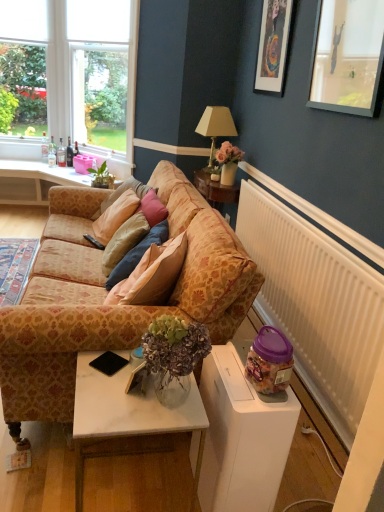
Identify the location of pink fabric couch at left. (34, 181).

Image resolution: width=384 pixels, height=512 pixels. What do you see at coordinates (34, 181) in the screenshot?
I see `pink fabric couch at left` at bounding box center [34, 181].

Locate an element on the screen. purple plastic jar at lower right is located at coordinates (242, 436).

I want to click on green leafy plant at center, so click(101, 177).

You are a GUI agent. You are given a task and a screenshot of the screen. Output one action in this format:
    pyautogui.click(x=<x>, y=<y>)
    Task: Click on the matte black picture frame at upper right
    
    Given the screenshot: What is the action you would take?
    pyautogui.click(x=273, y=46)

Describe the element at coordinates (70, 74) in the screenshot. I see `clear glass window at upper left` at that location.

At what (x,y) coordinates should I click in order to perform the action: click on clear glass window at upper left. Please return your answer as a coordinate pair (x, y). The width and height of the screenshot is (384, 512). Looking at the image, I should click on [24, 64].

From the picture: Who is bigger, matte gold lamp at upper center or black matte phone at lower center?

matte gold lamp at upper center is bigger.

Does matte gold lamp at upper center contain black matte phone at lower center?

No, black matte phone at lower center is not a part of matte gold lamp at upper center.

Could you tell me if matte gold lamp at upper center is turned towards black matte phone at lower center?

No, matte gold lamp at upper center is not turned towards black matte phone at lower center.

From a real-world perspective, which object rests below the other?

From a 3D spatial view, black matte phone at lower center is below.

Is purple plastic jar at lower right located within green leafy plant at center?

No, purple plastic jar at lower right is not inside green leafy plant at center.

How much distance is there between green leafy plant at center and purple plastic jar at lower right?

A distance of 2.54 meters exists between green leafy plant at center and purple plastic jar at lower right.

Is green leafy plant at center smaller than purple plastic jar at lower right?

Yes, green leafy plant at center is smaller than purple plastic jar at lower right.

Are green leafy plant at center and purple plastic jar at lower right making contact?

No, green leafy plant at center is not making contact with purple plastic jar at lower right.

Is purple plastic jar at lower right positioned behind white marble table at lower center?

→ Yes, purple plastic jar at lower right is further from the camera.

How many degrees apart are the facing directions of purple plastic jar at lower right and white marble table at lower center?

0.143 degrees.

Considering the relative sizes of purple plastic jar at lower right and white marble table at lower center in the image provided, is purple plastic jar at lower right bigger than white marble table at lower center?

Incorrect, purple plastic jar at lower right is not larger than white marble table at lower center.

From a real-world perspective, is purple plastic jar at lower right physically above white marble table at lower center?

Yes, from a real-world perspective, purple plastic jar at lower right is above white marble table at lower center.

From a real-world perspective, does matte gold lamp at upper center stand above patterned fabric couch at center?

Yes, from a real-world perspective, matte gold lamp at upper center is on top of patterned fabric couch at center.

From the picture: What's the angular difference between matte gold lamp at upper center and patterned fabric couch at center's facing directions?

0.321 degrees separate the facing orientations of matte gold lamp at upper center and patterned fabric couch at center.

From the image's perspective, who appears lower, matte gold lamp at upper center or patterned fabric couch at center?

From the image's view, patterned fabric couch at center is below.

Locate an element on the screen. bottle that is the 2nd one when counting downward from the matte black picture frame at upper right (from the image's perspective) is located at coordinates (52, 153).

What's the angular difference between translucent glass bottle at window, the second bottle positioned from the left, and matte black picture frame at upper right's facing directions?

translucent glass bottle at window, the second bottle positioned from the left, and matte black picture frame at upper right are facing 91.4 degrees away from each other.

Which is correct: translucent glass bottle at window, which is counted as the third bottle, starting from the right, is inside matte black picture frame at upper right, or outside of it?

translucent glass bottle at window, which is counted as the third bottle, starting from the right, is located beyond the bounds of matte black picture frame at upper right.

Is translucent glass bottle at window, which is counted as the third bottle, starting from the right, facing away from matte black picture frame at upper right?

No.

Is dark brown glass bottle at left, positioned as the first bottle in right-to-left order, situated inside translucent glass bottle at window, which is counted as the third bottle, starting from the right, or outside?

dark brown glass bottle at left, positioned as the first bottle in right-to-left order, cannot be found inside translucent glass bottle at window, which is counted as the third bottle, starting from the right.

Is dark brown glass bottle at left, placed as the 4th bottle when sorted from left to right, beside translucent glass bottle at window, which is counted as the third bottle, starting from the right?

dark brown glass bottle at left, placed as the 4th bottle when sorted from left to right, and translucent glass bottle at window, which is counted as the third bottle, starting from the right, are clearly separated.

Can you confirm if dark brown glass bottle at left, placed as the 4th bottle when sorted from left to right, is positioned to the right of translucent glass bottle at window, the second bottle positioned from the left?

Correct, you'll find dark brown glass bottle at left, placed as the 4th bottle when sorted from left to right, to the right of translucent glass bottle at window, the second bottle positioned from the left.

Considering the positions of objects dark brown glass bottle at left, placed as the 4th bottle when sorted from left to right, and translucent glass bottle at window, which is counted as the third bottle, starting from the right, in the image provided, who is behind, dark brown glass bottle at left, placed as the 4th bottle when sorted from left to right, or translucent glass bottle at window, which is counted as the third bottle, starting from the right,?

translucent glass bottle at window, which is counted as the third bottle, starting from the right, is further away from the camera.

From the image's perspective, is black plastic remote control at center above purple plastic jar at lower right?

Yes, from the image's perspective, black plastic remote control at center is above purple plastic jar at lower right.

Which is more to the right, black plastic remote control at center or purple plastic jar at lower right?

From the viewer's perspective, purple plastic jar at lower right appears more on the right side.

In terms of width, does black plastic remote control at center look wider or thinner when compared to purple plastic jar at lower right?

Considering their sizes, black plastic remote control at center looks slimmer than purple plastic jar at lower right.

Can you tell me how much black plastic remote control at center and purple plastic jar at lower right differ in facing direction?

There is a 46.5-degree angle between the facing directions of black plastic remote control at center and purple plastic jar at lower right.

Where is `mobile phone in front of the matte gold lamp at upper center`? This screenshot has height=512, width=384. mobile phone in front of the matte gold lamp at upper center is located at coordinates (109, 362).

Locate an element on the screen. The width and height of the screenshot is (384, 512). houseplant behind the purple plastic jar at lower right is located at coordinates (101, 177).

Considering their positions, is white marble table at lower center positioned closer to black plastic remote control at center than pink fabric couch at left?

Among the two, white marble table at lower center is located nearer to black plastic remote control at center.

When comparing their distances from black matte phone at lower center, does patterned fabric couch at center or translucent glass bottle at window, the second bottle positioned from the left, seem closer?

Among the two, patterned fabric couch at center is located nearer to black matte phone at lower center.

From the picture: Based on their spatial positions, is clear glass window at upper left or clear glass bottle at window, the first bottle positioned from the left, further from black matte phone at lower center?

Among the two, clear glass window at upper left is located further to black matte phone at lower center.

Which object lies nearer to the anchor point clear glass window at upper left, pink fabric couch at left or white marble table at lower center?

pink fabric couch at left.

From the image, which object appears to be nearer to clear glass window at upper left, clear glass window at upper left or white marble table at lower center?

clear glass window at upper left is closer to clear glass window at upper left.

When comparing their distances from clear glass bottle at left, the 2th bottle when ordered from right to left, does matte black picture frame at upper right or black matte phone at lower center seem closer?

Among the two, matte black picture frame at upper right is located nearer to clear glass bottle at left, the 2th bottle when ordered from right to left.

Consider the image. Based on their spatial positions, is dark brown glass bottle at left, positioned as the first bottle in right-to-left order, or clear glass bottle at window, the fourth bottle when ordered from right to left, further from patterned fabric couch at center?

clear glass bottle at window, the fourth bottle when ordered from right to left, lies further to patterned fabric couch at center than the other object.

Estimate the real-world distances between objects in this image. Which object is further from translucent glass bottle at window, the second bottle positioned from the left, pink fabric couch at left or clear glass bottle at left, the 2th bottle when ordered from right to left?

Among the two, pink fabric couch at left is located further to translucent glass bottle at window, the second bottle positioned from the left.

Identify the location of picture frame positioned between white marble table at lower center and clear glass window at upper left from near to far. The width and height of the screenshot is (384, 512). (273, 46).

You are a GUI agent. You are given a task and a screenshot of the screen. Output one action in this format:
    pyautogui.click(x=<x>, y=<y>)
    Task: Click on the desk positioned between black plastic remote control at center and translucent glass bottle at window, which is counted as the third bottle, starting from the right, from near to far
    
    Given the screenshot: What is the action you would take?
    pyautogui.click(x=34, y=181)

In order to click on remote control between purple plastic jar at lower right and green leafy plant at center along the z-axis in this screenshot , I will do `click(94, 242)`.

Image resolution: width=384 pixels, height=512 pixels. I want to click on remote control positioned between white marble table at lower center and matte gold lamp at upper center from near to far, so click(94, 242).